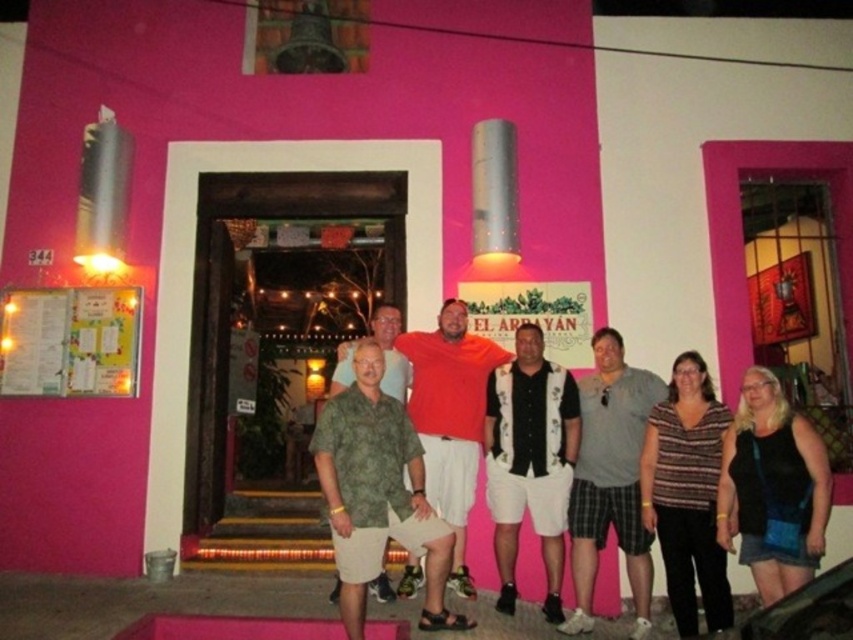
Question: Is black textured shirt at center to the right of green camo shirt at center from the viewer's perspective?

Choices:
 (A) yes
 (B) no

Answer: (A)

Question: Which is nearer to the matte orange shirt at center?

Choices:
 (A) black textured shirt at center
 (B) striped fabric shirt at center
 (C) gray cotton t-shirt at center

Answer: (A)

Question: Is black textured shirt at center to the left of green camo shirt at center from the viewer's perspective?

Choices:
 (A) yes
 (B) no

Answer: (B)

Question: Which point is closer to the camera taking this photo?

Choices:
 (A) (486, 442)
 (B) (346, 360)
 (C) (675, 589)
 (D) (461, 522)

Answer: (C)

Question: Is matte orange shirt at center in front of green camo shirt at center?

Choices:
 (A) yes
 (B) no

Answer: (B)

Question: Estimate the real-world distances between objects in this image. Which object is closer to the green camo shirt at center?

Choices:
 (A) matte orange shirt at center
 (B) black textured shirt at center
 (C) gray cotton t-shirt at center
 (D) striped fabric shirt at center

Answer: (A)